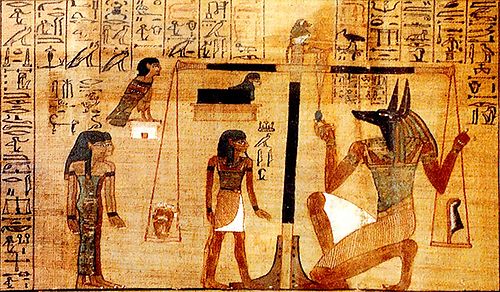
The image size is (500, 292). I want to click on pot, so click(165, 220).